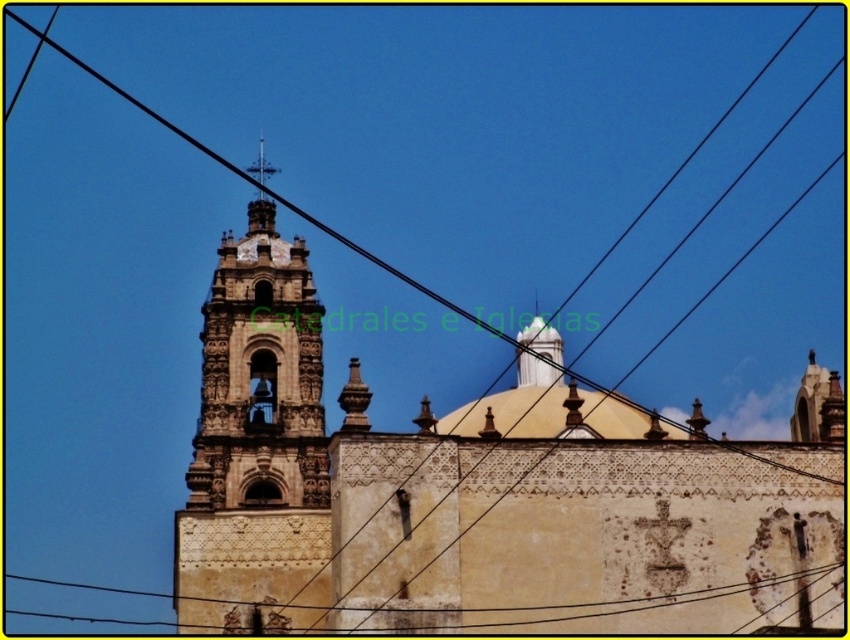
Question: Is black wire at upper center bigger than polished silver spire at upper center?

Choices:
 (A) no
 (B) yes

Answer: (B)

Question: Which point is farther from the camera taking this photo?

Choices:
 (A) (259, 141)
 (B) (224, 545)
 (C) (516, 598)
 (D) (748, 36)

Answer: (D)

Question: Which object is positioned farthest from the polished silver spire at upper center?

Choices:
 (A) black wire at upper center
 (B) carved stone tower at center

Answer: (A)

Question: Can you confirm if black wire at upper center is positioned above polished silver spire at upper center?

Choices:
 (A) no
 (B) yes

Answer: (A)

Question: Which of these objects is positioned farthest from the carved stone tower at center?

Choices:
 (A) polished silver spire at upper center
 (B) black wire at upper center
 (C) yellow stucco church at center

Answer: (A)

Question: Can you confirm if yellow stucco church at center is positioned above carved stone tower at center?

Choices:
 (A) no
 (B) yes

Answer: (B)